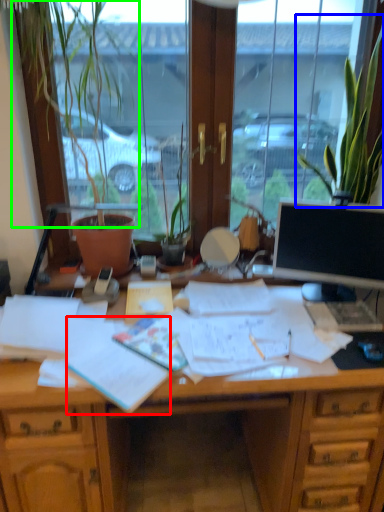
Question: Based on their relative distances, which object is nearer to document (highlighted by a red box)? Choose from houseplant (highlighted by a blue box) and plant (highlighted by a green box).

Choices:
 (A) houseplant
 (B) plant

Answer: (B)